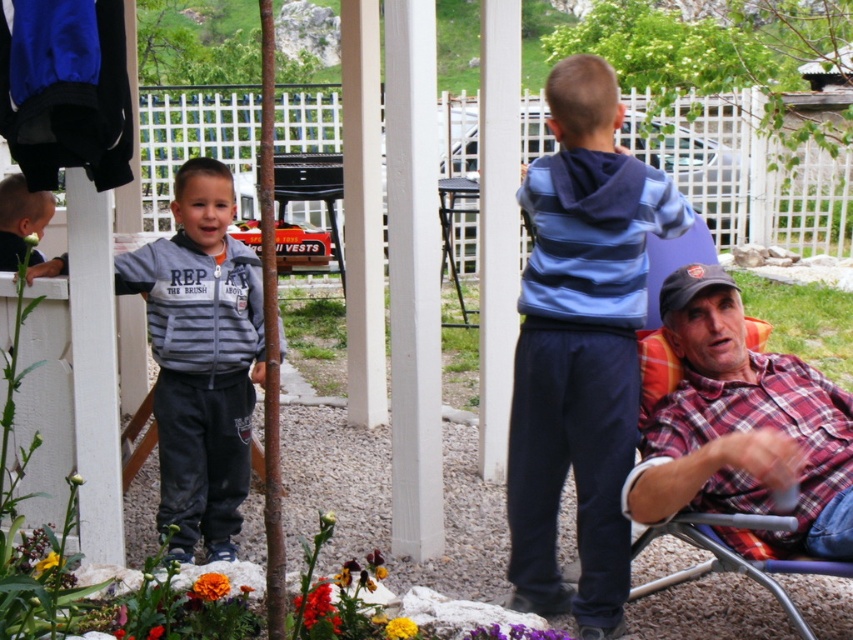
Question: Can you confirm if blue striped hoodie at upper right is thinner than gray fleece jacket at left?

Choices:
 (A) yes
 (B) no

Answer: (B)

Question: Which point appears farthest from the camera in this image?

Choices:
 (A) pos(315,588)
 (B) pos(149,637)
 (C) pos(575,177)
 (D) pos(202,593)

Answer: (C)

Question: Which of the following is the farthest from the observer?

Choices:
 (A) gray fleece jacket at left
 (B) yellow matte flower at lower left

Answer: (A)

Question: Which point is closer to the camera?

Choices:
 (A) (408, 620)
 (B) (317, 632)
 (C) (660, 428)

Answer: (B)

Question: Is gray fleece jacket at left to the left of bright orange petal at center from the viewer's perspective?

Choices:
 (A) no
 (B) yes

Answer: (B)

Question: Does gray fleece jacket at left come in front of bright orange petals at lower center?

Choices:
 (A) yes
 (B) no

Answer: (B)